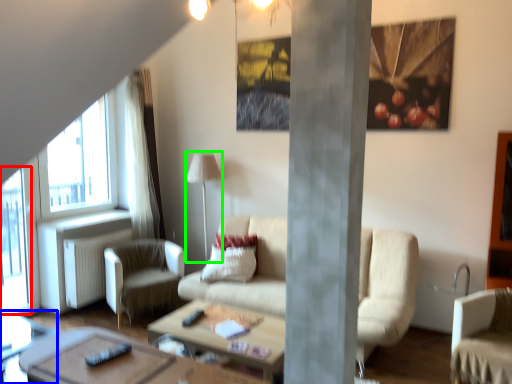
Question: Which object is the closest to the window screen (highlighted by a red box)? Choose among these: side table (highlighted by a blue box) or lamp (highlighted by a green box).

Choices:
 (A) side table
 (B) lamp

Answer: (A)